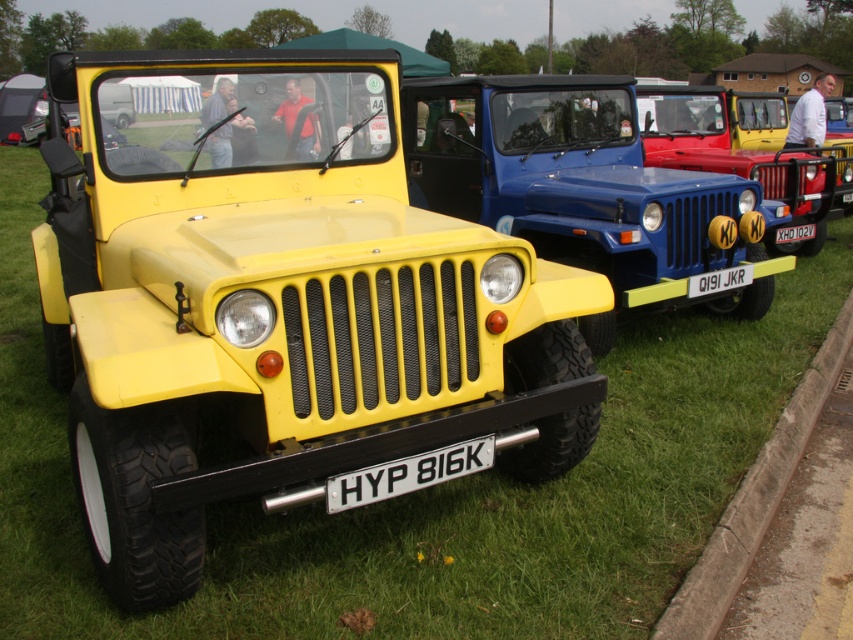
Question: Can you confirm if matte blue jeep at center is positioned below black plastic license plate at center?

Choices:
 (A) no
 (B) yes

Answer: (A)

Question: Estimate the real-world distances between objects in this image. Which object is farther from the matte yellow jeep at center?

Choices:
 (A) black plastic license plate at center
 (B) white plastic license plate at center
 (C) matte blue jeep at center
 (D) white metallic license plate at center

Answer: (D)

Question: Can you confirm if matte yellow jeep at center is positioned to the left of matte blue jeep at center?

Choices:
 (A) yes
 (B) no

Answer: (A)

Question: Among these points, which one is farthest from the camera?

Choices:
 (A) (784, 227)
 (B) (734, 100)
 (C) (469, 460)

Answer: (B)

Question: Which object is farther from the camera taking this photo?

Choices:
 (A) white plastic license plate at center
 (B) matte yellow jeep at center
 (C) matte blue jeep at center
 (D) black plastic license plate at center

Answer: (C)

Question: Can you confirm if matte blue jeep at center is smaller than white plastic license plate at center?

Choices:
 (A) yes
 (B) no

Answer: (B)